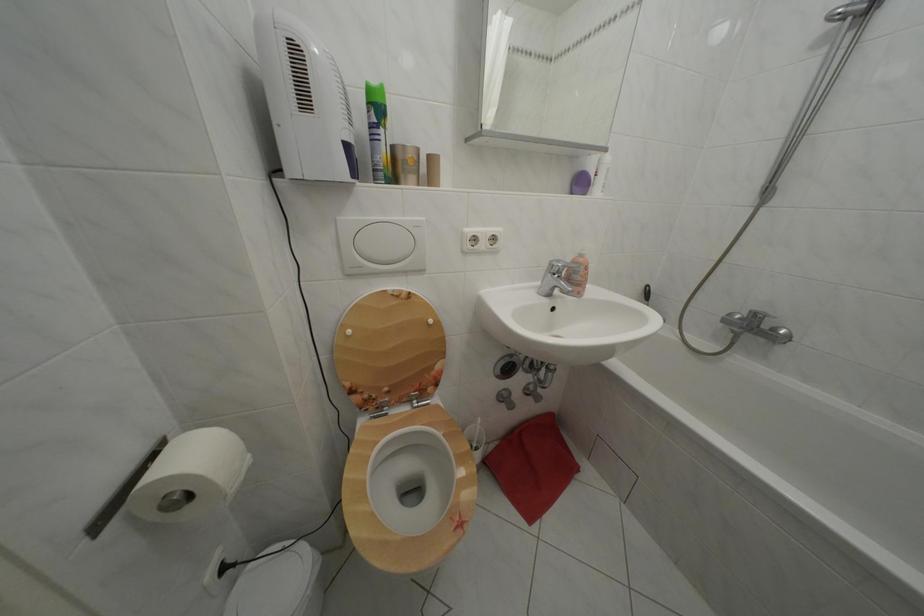
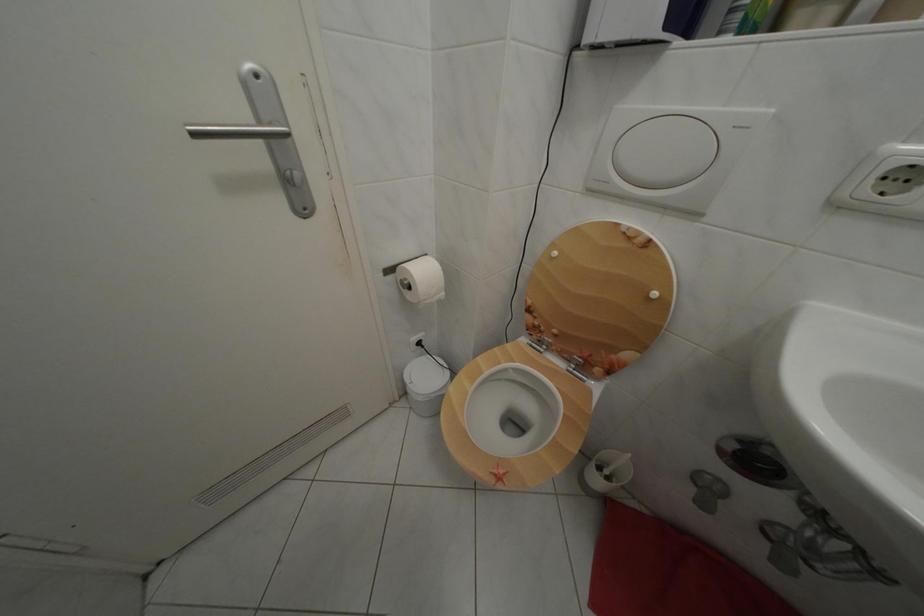
First-person continuous shooting, in which direction is the camera rotating?

The camera rotated toward left-down.